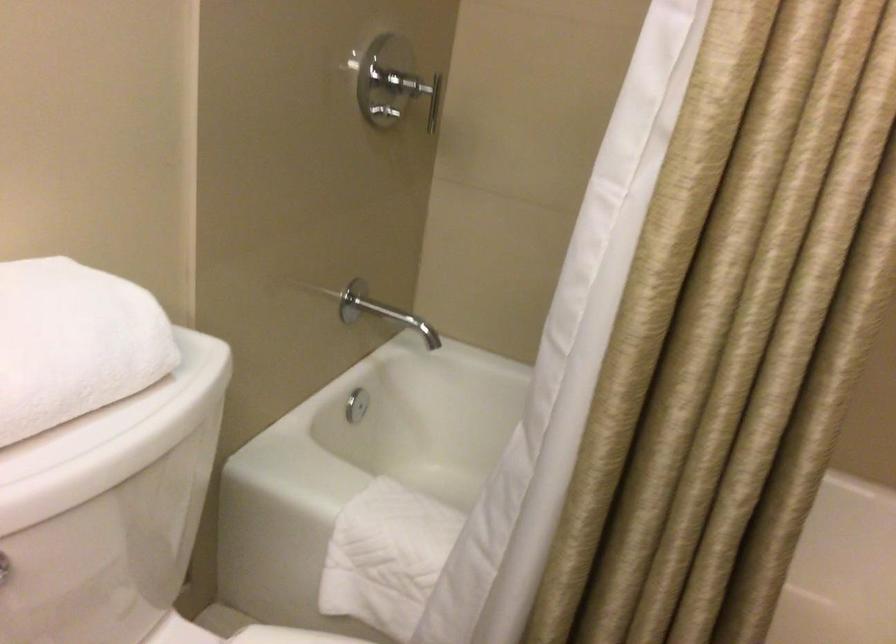
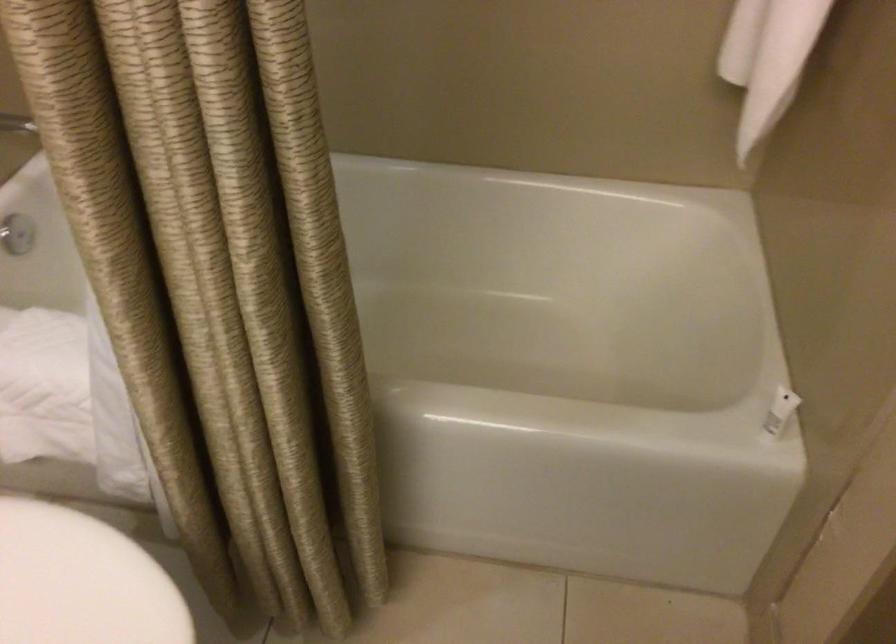
Question: Based on the continuous images, in which direction is the camera rotating? Reply with the corresponding letter.

Choices:
 (A) Left
 (B) Right
 (C) Up
 (D) Down

Answer: (D)